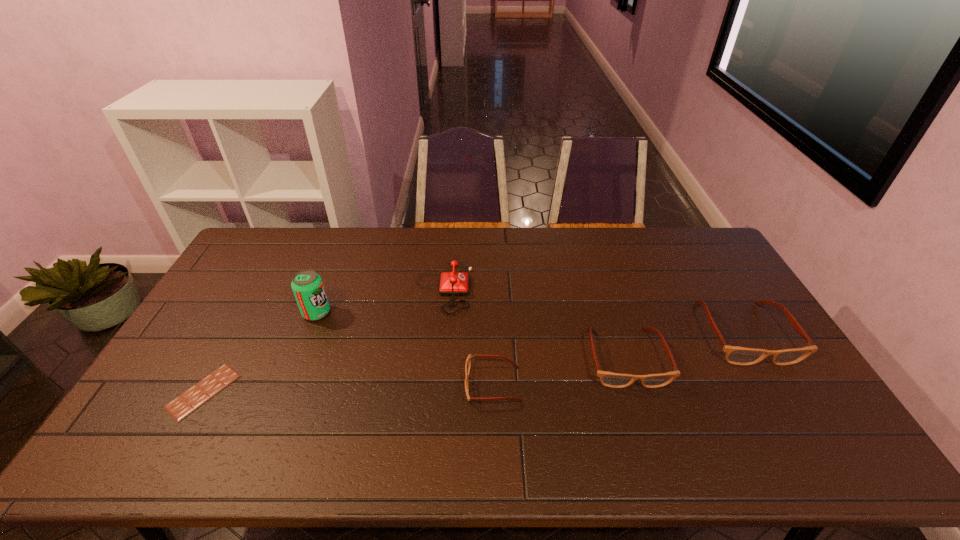
Identify the location of unoccupied area between the chocolate bar and the second tallest spectacles. The image size is (960, 540). (415, 375).

Locate an element on the screen. empty location between the rightmost spectacles and the shortest object is located at coordinates (473, 362).

Where is `free spot between the telephone and the leftmost object`? free spot between the telephone and the leftmost object is located at coordinates (324, 339).

Identify the location of vacant space that is in between the rightmost object and the leftmost object. (473, 362).

I want to click on free space between the rightmost object and the tallest object, so click(530, 323).

Find the location of a particular element. The image size is (960, 540). free spot between the second object from right to left and the second object from left to right is located at coordinates click(x=470, y=335).

Locate an element on the screen. The width and height of the screenshot is (960, 540). free area in between the second spectacles from right to left and the rightmost spectacles is located at coordinates (684, 346).

I want to click on empty space between the leftmost spectacles and the rightmost spectacles, so click(618, 359).

In order to click on free spot between the fifth tallest object and the tallest object in this screenshot , I will do `click(405, 349)`.

This screenshot has width=960, height=540. Find the location of `vacant space in between the telephone and the fifth object from left to right`. vacant space in between the telephone and the fifth object from left to right is located at coordinates (534, 322).